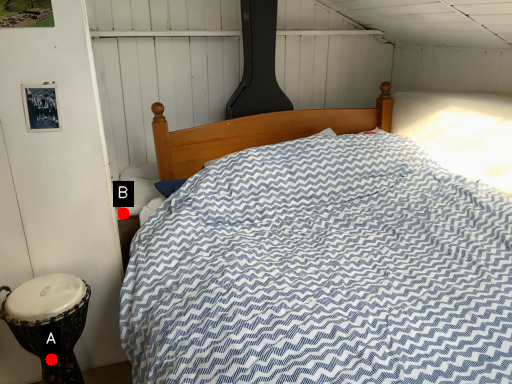
Question: Two points are circled on the image, labeled by A and B beside each circle. Among these points, which one is nearest to the camera?

Choices:
 (A) A is closer
 (B) B is closer

Answer: (A)